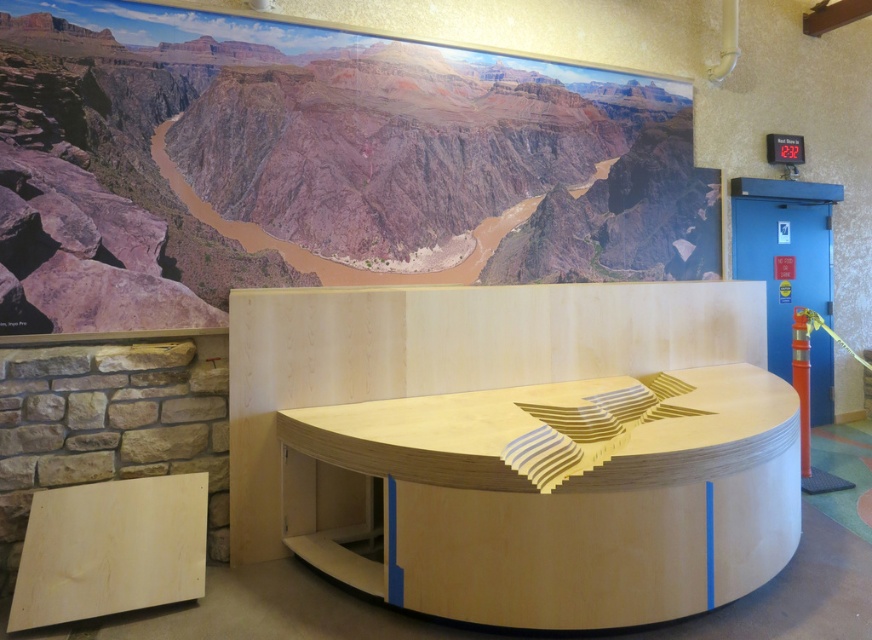
Does light wood/plywood table at center have a smaller size compared to natural wood stool at lower left?

Incorrect, light wood/plywood table at center is not smaller in size than natural wood stool at lower left.

Where is `light wood/plywood table at center`? light wood/plywood table at center is located at coordinates (563, 497).

Where is `light wood/plywood table at center`? The width and height of the screenshot is (872, 640). light wood/plywood table at center is located at coordinates (563, 497).